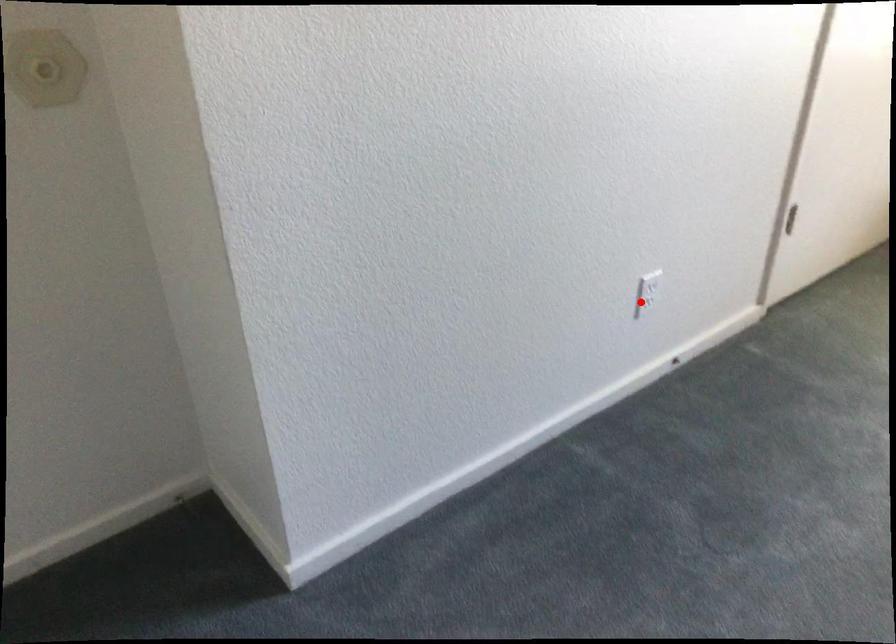
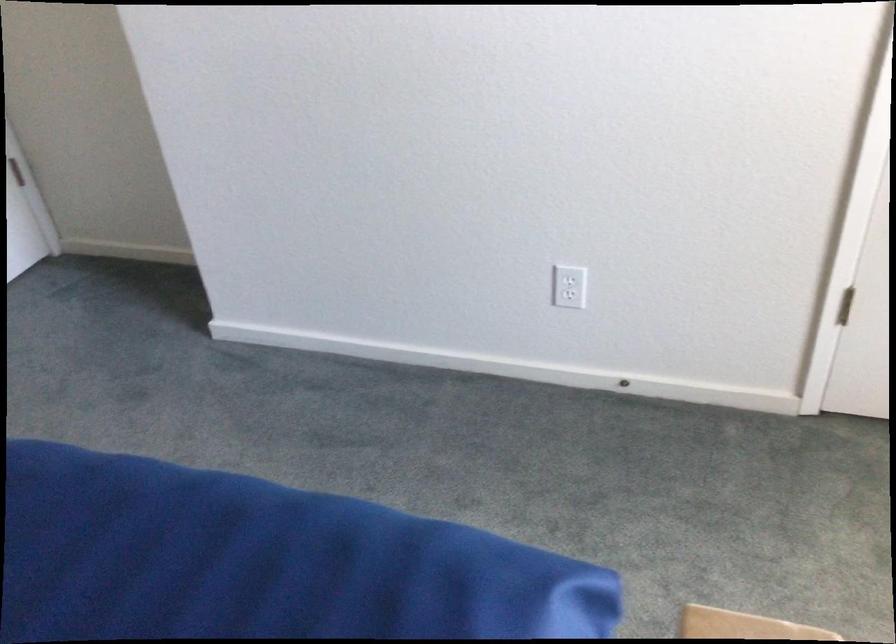
Find the pixel in the second image that matches the highlighted location in the first image.

(569, 295)